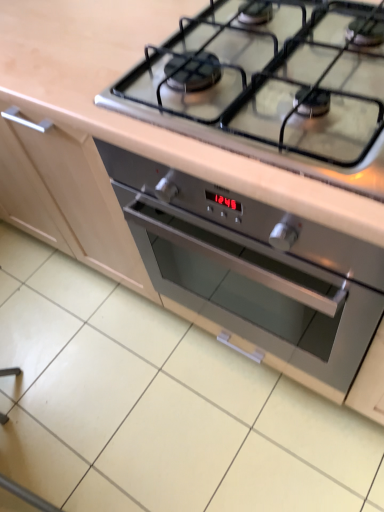
Measure the distance between stainless steel oven at center and camera.

24.36 inches.

Image resolution: width=384 pixels, height=512 pixels. What do you see at coordinates (254, 274) in the screenshot?
I see `stainless steel oven at center` at bounding box center [254, 274].

What is the approximate height of stainless steel oven at center?

The height of stainless steel oven at center is 29.45 inches.

In order to face stainless steel oven at center, should I rotate leftwards or rightwards?

A 12.655 degree turn to the right will do.

Image resolution: width=384 pixels, height=512 pixels. I want to click on stainless steel oven at center, so 254,274.

What are the coordinates of `stainless steel gas stove at upper center` in the screenshot? It's located at (269, 82).

In order to face stainless steel gas stove at upper center, should I rotate leftwards or rightwards?

Turn right approximately 12.315 degrees to face it.

The height and width of the screenshot is (512, 384). What do you see at coordinates (269, 82) in the screenshot? I see `stainless steel gas stove at upper center` at bounding box center [269, 82].

What are the coordinates of `stainless steel oven at center` in the screenshot? It's located at (254, 274).

Is stainless steel oven at center to the left or to the right of stainless steel gas stove at upper center in the image?

Based on their positions, stainless steel oven at center is located to the right of stainless steel gas stove at upper center.

Considering their positions, is stainless steel oven at center located in front of or behind stainless steel gas stove at upper center?

In the image, stainless steel oven at center appears behind stainless steel gas stove at upper center.

Which point is more forward, (146,182) or (254,12)?

Positioned in front is point (146,182).

From the image's perspective, is stainless steel oven at center positioned above or below stainless steel gas stove at upper center?

Clearly, from the image's perspective, stainless steel oven at center is below stainless steel gas stove at upper center.

From a real-world perspective, is stainless steel oven at center on top of stainless steel gas stove at upper center?

No, from a real-world perspective, stainless steel oven at center is not on top of stainless steel gas stove at upper center.

Which object is thinner, stainless steel oven at center or stainless steel gas stove at upper center?

Thinner between the two is stainless steel gas stove at upper center.

Which of these two, stainless steel oven at center or stainless steel gas stove at upper center, stands taller?

Standing taller between the two is stainless steel oven at center.

Looking at the image, does stainless steel oven at center seem bigger or smaller compared to stainless steel gas stove at upper center?

Clearly, stainless steel oven at center is larger in size than stainless steel gas stove at upper center.

Would you say stainless steel oven at center is outside stainless steel gas stove at upper center?

Absolutely, stainless steel oven at center is external to stainless steel gas stove at upper center.

Is stainless steel oven at center not close to stainless steel gas stove at upper center?

No, stainless steel oven at center is in close proximity to stainless steel gas stove at upper center.

Is stainless steel oven at center turned away from stainless steel gas stove at upper center?

stainless steel oven at center does not have its back to stainless steel gas stove at upper center.

What's the angular difference between stainless steel oven at center and stainless steel gas stove at upper center's facing directions?

They differ by 1.43 degrees in their facing directions.

Measure the distance from stainless steel oven at center to stainless steel gas stove at upper center.

The distance of stainless steel oven at center from stainless steel gas stove at upper center is 12.78 inches.

Identify the location of oven behind the stainless steel gas stove at upper center. (254, 274).

From the picture: Considering the relative positions of stainless steel gas stove at upper center and stainless steel oven at center in the image provided, is stainless steel gas stove at upper center to the right of stainless steel oven at center from the viewer's perspective?

In fact, stainless steel gas stove at upper center is to the left of stainless steel oven at center.

Which object is further away from the camera, stainless steel gas stove at upper center or stainless steel oven at center?

Positioned behind is stainless steel oven at center.

Between point (300, 22) and point (186, 311), which one is positioned behind?

Point (186, 311)

From the image's perspective, is stainless steel gas stove at upper center located above stainless steel oven at center?

Yes, from the image's perspective, stainless steel gas stove at upper center is over stainless steel oven at center.

From a real-world perspective, which is physically below, stainless steel gas stove at upper center or stainless steel oven at center?

stainless steel oven at center, from a real-world perspective.

Considering the relative sizes of stainless steel gas stove at upper center and stainless steel oven at center in the image provided, is stainless steel gas stove at upper center thinner than stainless steel oven at center?

Yes, stainless steel gas stove at upper center is thinner than stainless steel oven at center.

Is stainless steel gas stove at upper center taller than stainless steel oven at center?

No.

Consider the image. Considering the sizes of stainless steel gas stove at upper center and stainless steel oven at center in the image, is stainless steel gas stove at upper center bigger or smaller than stainless steel oven at center?

Clearly, stainless steel gas stove at upper center is smaller in size than stainless steel oven at center.

Is stainless steel oven at center a part of stainless steel gas stove at upper center?

No.

Is stainless steel gas stove at upper center positioned far away from stainless steel oven at center?

No, stainless steel gas stove at upper center is not far away from stainless steel oven at center.

Could you tell me if stainless steel gas stove at upper center is facing stainless steel oven at center?

No, stainless steel gas stove at upper center does not turn towards stainless steel oven at center.

How many degrees apart are the facing directions of stainless steel gas stove at upper center and stainless steel oven at center?

The angle between the facing direction of stainless steel gas stove at upper center and the facing direction of stainless steel oven at center is 1.43 degrees.

From the picture: How far apart are stainless steel gas stove at upper center and stainless steel oven at center?

stainless steel gas stove at upper center and stainless steel oven at center are 12.78 inches apart from each other.

The image size is (384, 512). Identify the location of oven behind the stainless steel gas stove at upper center. (254, 274).

The image size is (384, 512). In order to click on gas stove located on the left of stainless steel oven at center in this screenshot , I will do `click(269, 82)`.

Identify the location of oven on the right of the stainless steel gas stove at upper center. (254, 274).